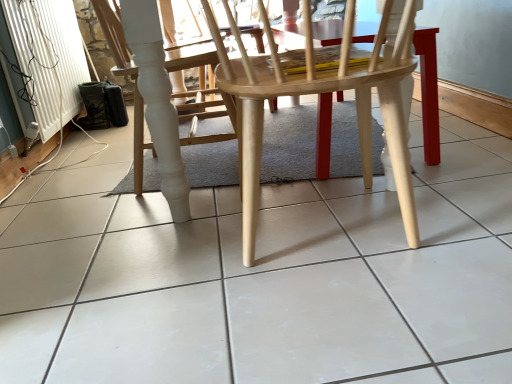
What are the coordinates of `vacant region to the left of natural wood chair at center, the second chair when ordered from left to right` in the screenshot? It's located at (142, 264).